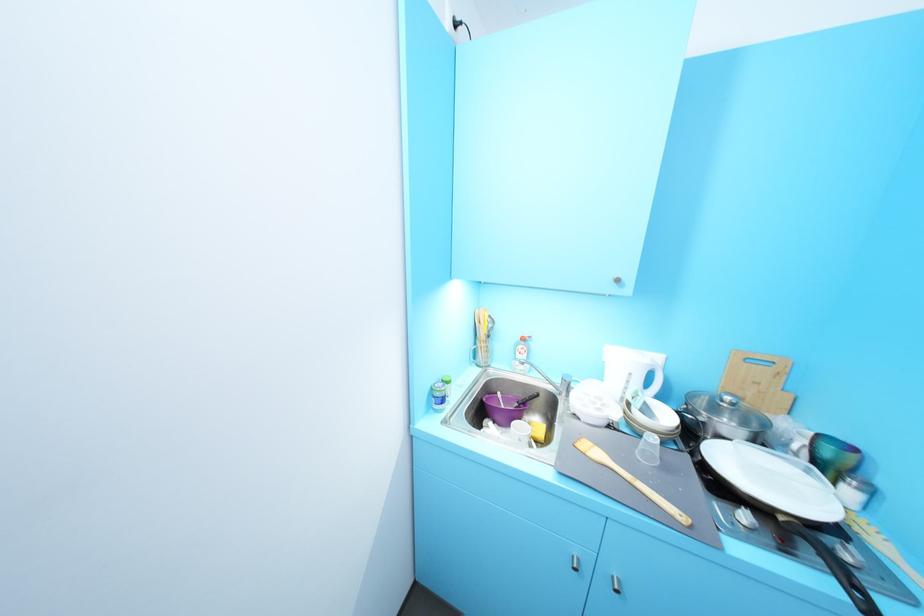
Where would you lift the kettle handle? Please return your answer as a coordinate pair (x, y).

(833, 565)